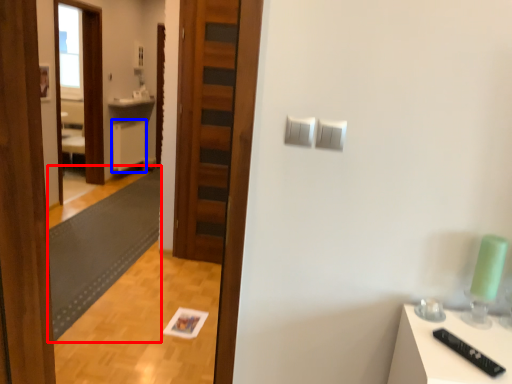
Question: Which object is further to the camera taking this photo, mat (highlighted by a red box) or cabinetry (highlighted by a blue box)?

Choices:
 (A) mat
 (B) cabinetry

Answer: (B)